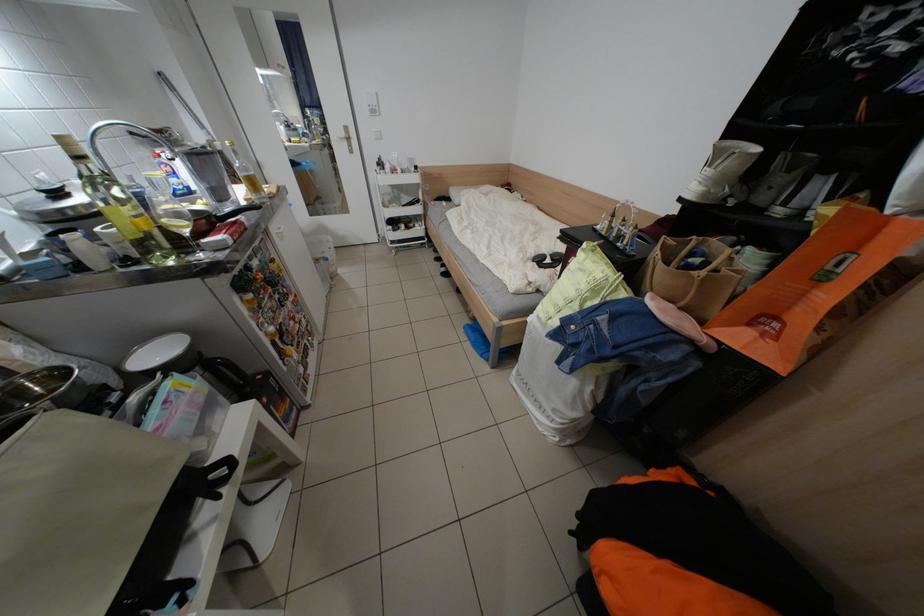
Which object does [116,203] point to?

It corresponds to the clear glass bottle in the image.